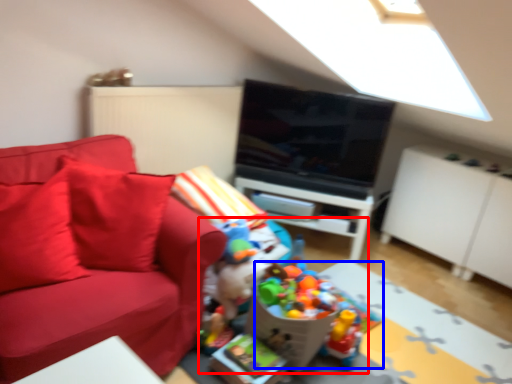
Question: Which point is further to the camera, toy (highlighted by a red box) or toy (highlighted by a blue box)?

Choices:
 (A) toy
 (B) toy

Answer: (B)